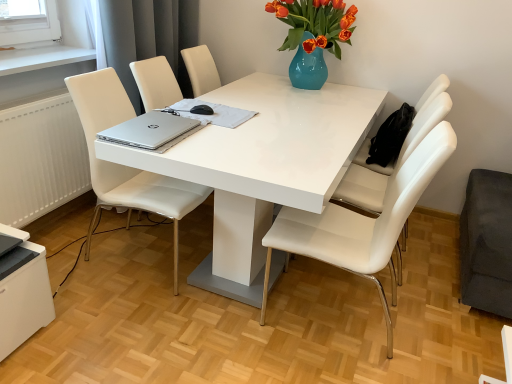
Where is `vacant region to the right of white leather chair at right, which ranks as the second chair in left-to-right order`? vacant region to the right of white leather chair at right, which ranks as the second chair in left-to-right order is located at coordinates (432, 324).